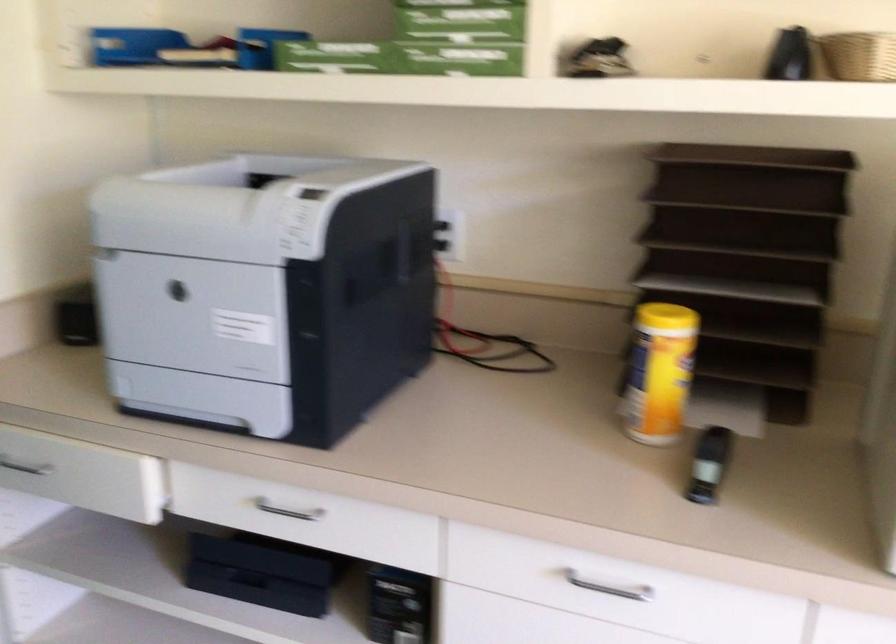
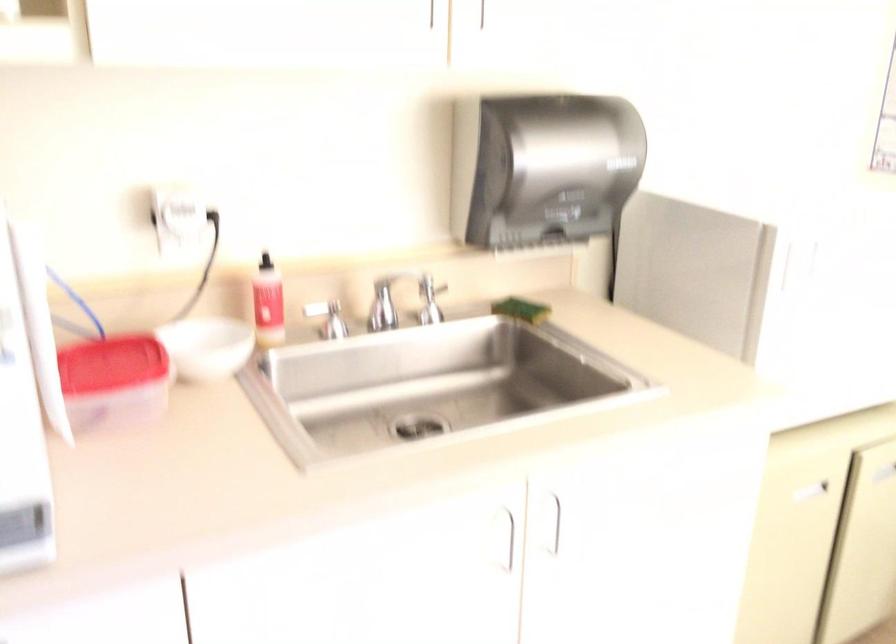
Question: The camera is either moving clockwise (left) or counter-clockwise (right) around the object. The first image is from the beginning of the video and the second image is from the end. Is the camera moving left or right when shooting the video?

Choices:
 (A) Left
 (B) Right

Answer: (A)